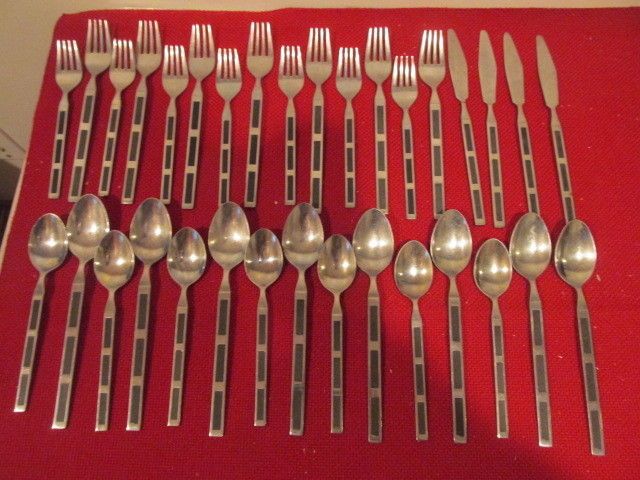
Locate an element on the screen. The image size is (640, 480). butter knife is located at coordinates (459, 77), (491, 82), (518, 83), (548, 82).